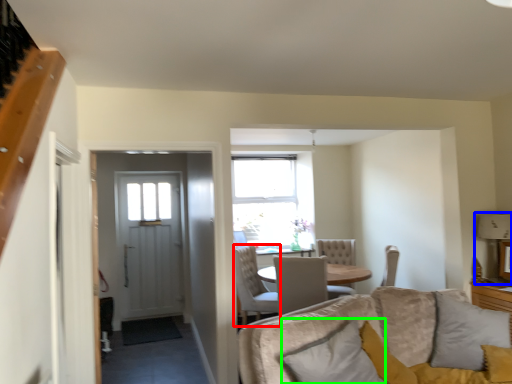
Question: Estimate the real-world distances between objects in this image. Which object is farther from chair (highlighted by a red box), lamp (highlighted by a blue box) or pillow (highlighted by a green box)?

Choices:
 (A) lamp
 (B) pillow

Answer: (A)